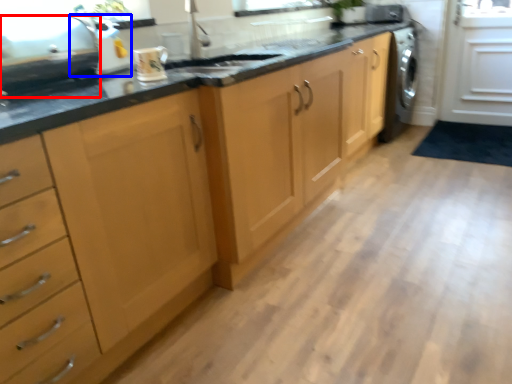
Question: Which object is closer to the camera taking this photo, appliance (highlighted by a red box) or appliance (highlighted by a blue box)?

Choices:
 (A) appliance
 (B) appliance

Answer: (A)